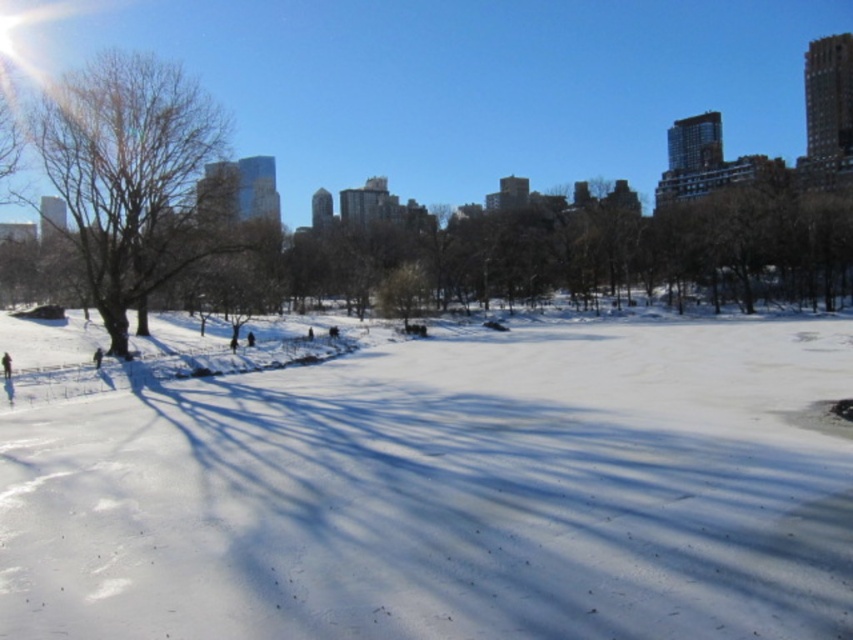
Between white powdery snow at center and bare brown tree at left, which one has less height?

white powdery snow at center is shorter.

Who is more forward, (720, 516) or (90, 180)?

Point (720, 516)

Who is more forward, (x=288, y=401) or (x=106, y=321)?

Point (x=288, y=401)

Identify the location of white powdery snow at center. (447, 493).

Measure the distance from white powdery snow at center to dark blue jacket at lower left.

A distance of 20.68 meters exists between white powdery snow at center and dark blue jacket at lower left.

Does white powdery snow at center appear on the left side of dark blue jacket at lower left?

In fact, white powdery snow at center is to the right of dark blue jacket at lower left.

Describe the element at coordinates (447, 493) in the screenshot. This screenshot has width=853, height=640. I see `white powdery snow at center` at that location.

I want to click on white powdery snow at center, so click(447, 493).

Can you confirm if bare brown tree at left is wider than dark blue jacket at lower left?

Yes.

Can you confirm if bare brown tree at left is positioned to the left of dark blue jacket at lower left?

No, bare brown tree at left is not to the left of dark blue jacket at lower left.

Which is behind, point (167, 140) or point (4, 374)?

Positioned behind is point (167, 140).

Where is `bare brown tree at left`? bare brown tree at left is located at coordinates point(134,177).